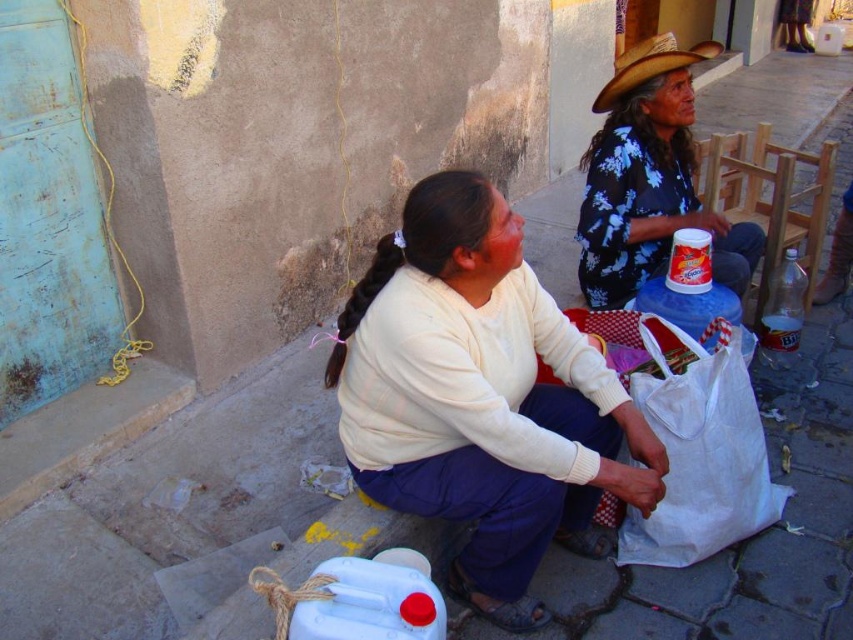
Between white plastic bag at lower right and straw textured cowboy hat at upper right, which one has less height?

straw textured cowboy hat at upper right is shorter.

Which is in front, point (648, 416) or point (668, 38)?

Point (648, 416) is more forward.

At what (x,y) coordinates should I click in order to perform the action: click on white plastic bag at lower right. Please return your answer as a coordinate pair (x, y). Looking at the image, I should click on (700, 449).

At what (x,y) coordinates should I click in order to perform the action: click on white plastic bag at lower right. Please return your answer as a coordinate pair (x, y). Image resolution: width=853 pixels, height=640 pixels. Looking at the image, I should click on (700, 449).

Who is more distant from viewer, [618,112] or [660,68]?

Positioned behind is point [618,112].

Can you confirm if floral fabric blouse at upper right is thinner than straw textured cowboy hat at upper right?

No.

Between point (642, 145) and point (621, 65), which one is positioned behind?

The point (621, 65) is behind.

You are a GUI agent. You are given a task and a screenshot of the screen. Output one action in this format:
    pyautogui.click(x=<x>, y=<y>)
    Task: Click on the floral fabric blouse at upper right
    Image resolution: width=853 pixels, height=640 pixels.
    Given the screenshot: What is the action you would take?
    pyautogui.click(x=648, y=179)

This screenshot has width=853, height=640. Describe the element at coordinates (480, 397) in the screenshot. I see `white matte sweater at center` at that location.

Is point (554, 500) in front of point (708, 419)?

That is True.

Where is `white matte sweater at center`? Image resolution: width=853 pixels, height=640 pixels. white matte sweater at center is located at coordinates (480, 397).